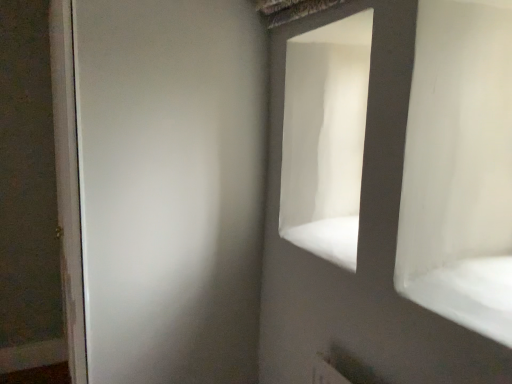
Identify the location of white matte screen door at left. (170, 188).

The height and width of the screenshot is (384, 512). What do you see at coordinates (170, 188) in the screenshot? I see `white matte screen door at left` at bounding box center [170, 188].

The width and height of the screenshot is (512, 384). Identify the location of white matte screen door at left. (170, 188).